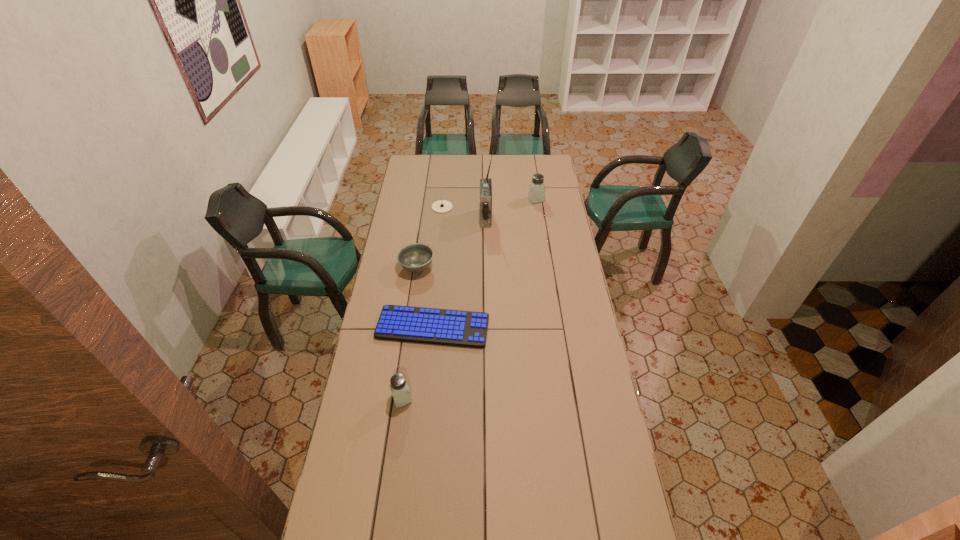
Find the location of `free space between the radio receiver and the left saltshaker`. free space between the radio receiver and the left saltshaker is located at coordinates (444, 308).

At what (x,y) coordinates should I click in order to perform the action: click on free space between the farther saltshaker and the nearer saltshaker. Please return your answer as a coordinate pair (x, y). The width and height of the screenshot is (960, 540). Looking at the image, I should click on (468, 299).

The image size is (960, 540). I want to click on empty space that is in between the radio receiver and the compass, so click(464, 213).

At what (x,y) coordinates should I click in order to perform the action: click on vacant area between the second shortest object and the computer keyboard. Please return your answer as a coordinate pair (x, y). The height and width of the screenshot is (540, 960). Looking at the image, I should click on (438, 267).

Find the location of a particular element. The image size is (960, 540). free space between the left saltshaker and the fifth shortest object is located at coordinates (468, 299).

Where is `object that is the second closest to the second nearest object`? The image size is (960, 540). object that is the second closest to the second nearest object is located at coordinates (399, 388).

Point out which object is positioned as the third nearest to the nearer saltshaker. Please provide its 2D coordinates. Your answer should be formatted as a tuple, i.e. [(x, y)], where the tuple contains the x and y coordinates of a point satisfying the conditions above.

[(485, 183)]